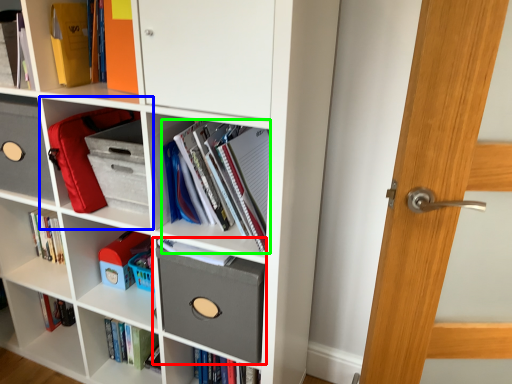
Question: Considering the real-world distances, which object is closest to shelf (highlighted by a red box)? shelf (highlighted by a blue box) or book (highlighted by a green box).

Choices:
 (A) shelf
 (B) book

Answer: (B)